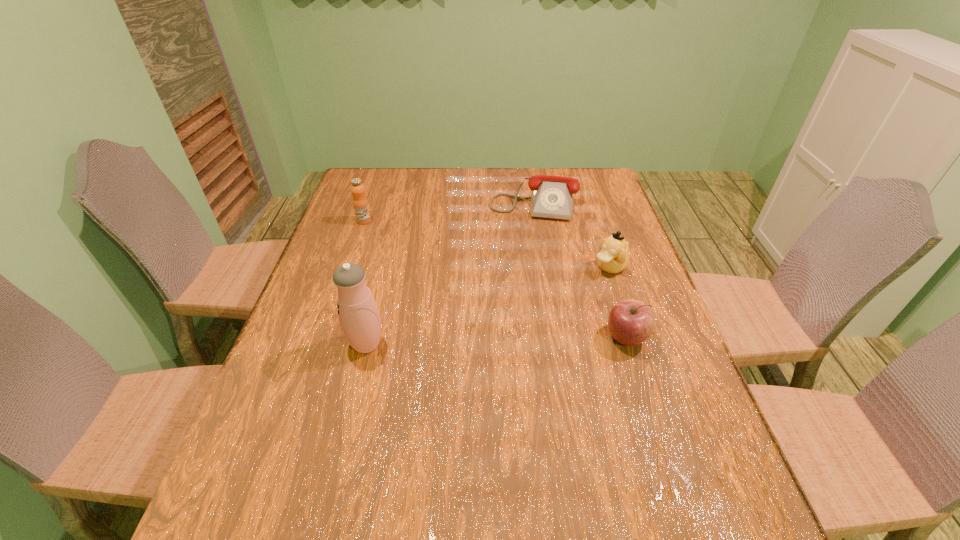
The height and width of the screenshot is (540, 960). I want to click on vacant space at the far right corner of the desktop, so click(x=595, y=177).

Find the location of `free space at the near right corner of the desktop`. free space at the near right corner of the desktop is located at coordinates (671, 463).

This screenshot has height=540, width=960. Find the location of `blank region between the apple and the tallest object`. blank region between the apple and the tallest object is located at coordinates (496, 341).

At what (x,y) coordinates should I click in order to perform the action: click on free space between the shortest object and the third farthest object. Please return your answer as a coordinate pair (x, y). The height and width of the screenshot is (540, 960). Looking at the image, I should click on (571, 234).

Identify the location of free space between the orange juice and the fourth object from right to left. Image resolution: width=960 pixels, height=540 pixels. (366, 282).

I want to click on vacant region between the fourth object from right to left and the orange juice, so click(366, 282).

The width and height of the screenshot is (960, 540). In order to click on unoccupied area between the thermos bottle and the apple in this screenshot , I will do `click(496, 341)`.

At what (x,y) coordinates should I click in order to perform the action: click on free space between the telephone and the thermos bottle. Please return your answer as a coordinate pair (x, y). Looking at the image, I should click on (449, 272).

At what (x,y) coordinates should I click in order to perform the action: click on free area in between the orange juice and the fourth object from right to left. Please return your answer as a coordinate pair (x, y). This screenshot has width=960, height=540. Looking at the image, I should click on (366, 282).

Locate an element on the screen. Image resolution: width=960 pixels, height=540 pixels. free space between the third farthest object and the tallest object is located at coordinates (488, 306).